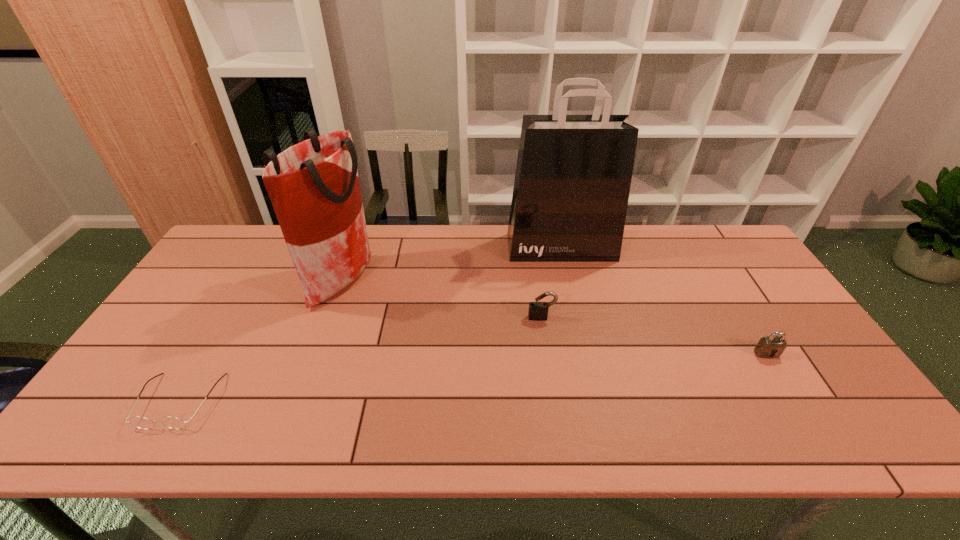
This screenshot has width=960, height=540. I want to click on the tallest object, so (573, 175).

Locate an element on the screen. Image resolution: width=960 pixels, height=540 pixels. the fourth shortest object is located at coordinates (314, 187).

Identify the location of grocery bag. The height and width of the screenshot is (540, 960). (314, 187).

Locate an element on the screen. This screenshot has height=540, width=960. the farther padlock is located at coordinates (538, 311).

Identify the location of the left padlock. This screenshot has height=540, width=960. pos(538,311).

Find the location of a particular element. Image resolution: width=960 pixels, height=540 pixels. the second nearest object is located at coordinates (772, 346).

At what (x,y) coordinates should I click in order to perform the action: click on the right padlock. Please return your answer as a coordinate pair (x, y). Looking at the image, I should click on (772, 346).

Image resolution: width=960 pixels, height=540 pixels. I want to click on spectacles, so click(171, 422).

Image resolution: width=960 pixels, height=540 pixels. What are the coordinates of `the leftmost object` in the screenshot? It's located at (171, 422).

Where is `vacant region located on the front with handles of the tallest object`? The height and width of the screenshot is (540, 960). vacant region located on the front with handles of the tallest object is located at coordinates (583, 342).